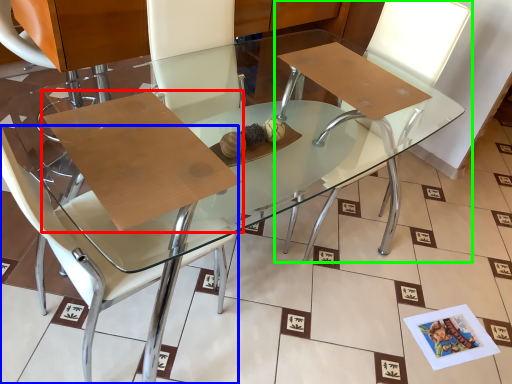
Question: Estimate the real-world distances between objects in this image. Which object is closer to cardboard (highlighted by a red box), chair (highlighted by a blue box) or chair (highlighted by a green box)?

Choices:
 (A) chair
 (B) chair

Answer: (A)